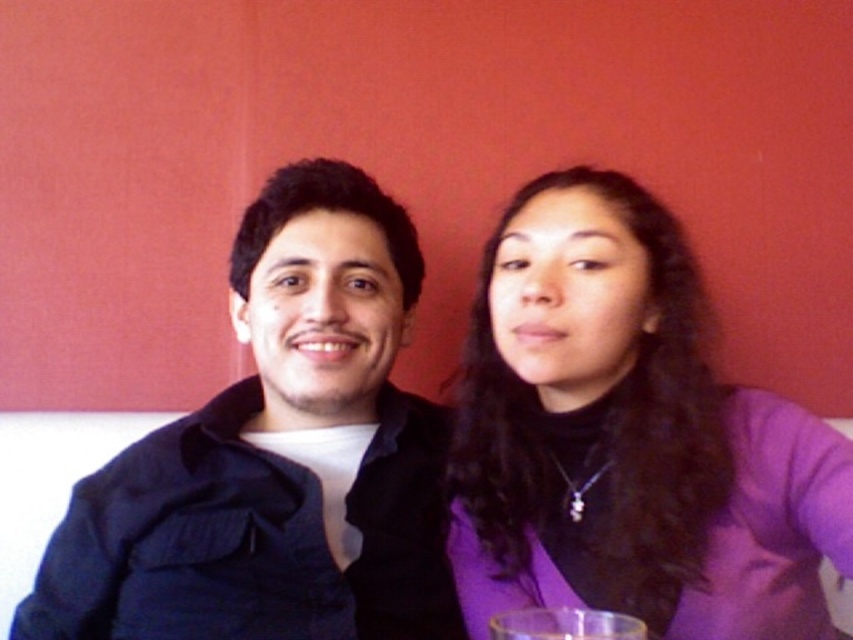
You are a photographer setting up for a portrait. You have a purple matte sweater at center and a transparent glass at lower center in the frame. Which object occupies more horizontal space in the image?

The purple matte sweater at center occupies more horizontal space than the transparent glass at lower center because its width surpasses the glass.

You are standing in front of the image and want to point to the exact location of the matte black shirt at center. What are the coordinates of the point where you should point?

The coordinates of the matte black shirt at center are at point (276, 456).